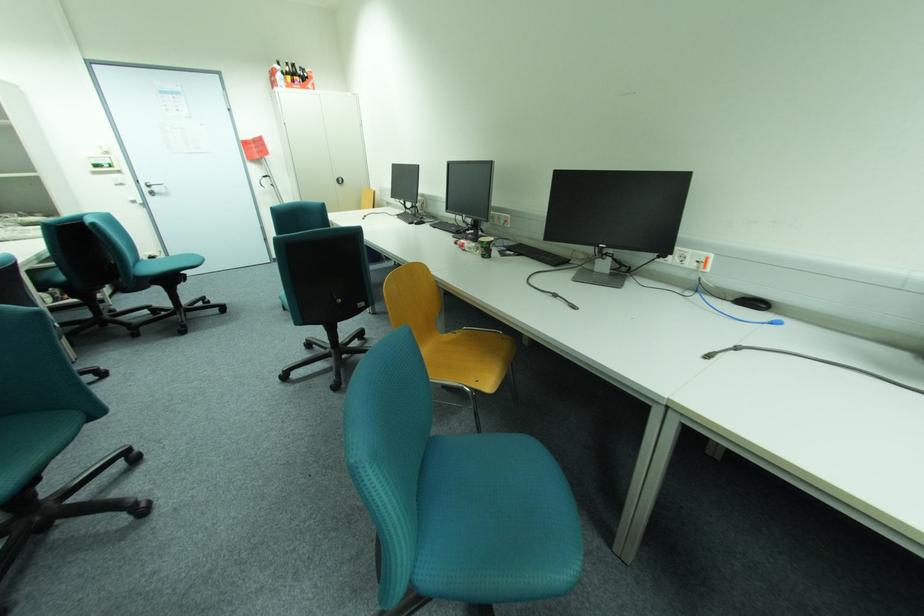
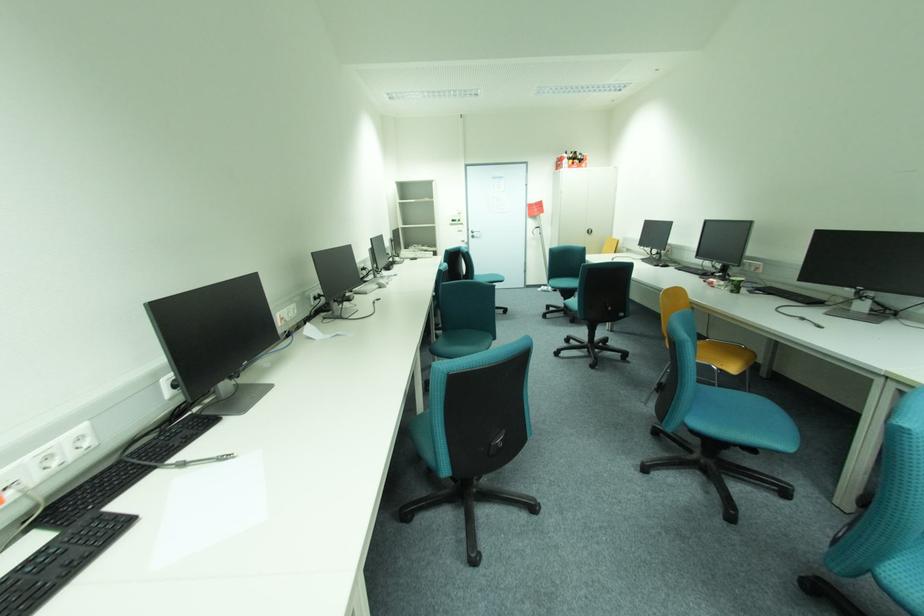
Locate, in the second image, the point that corresponds to the point at 152,190 in the first image.

(477, 235)